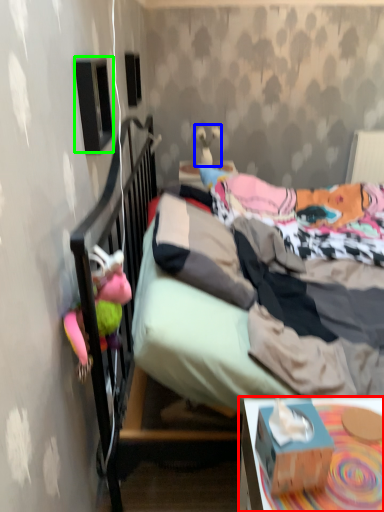
Question: Estimate the real-world distances between objects in this image. Which object is farther from desk (highlighted by a red box), toy (highlighted by a blue box) or loudspeaker (highlighted by a green box)?

Choices:
 (A) toy
 (B) loudspeaker

Answer: (A)